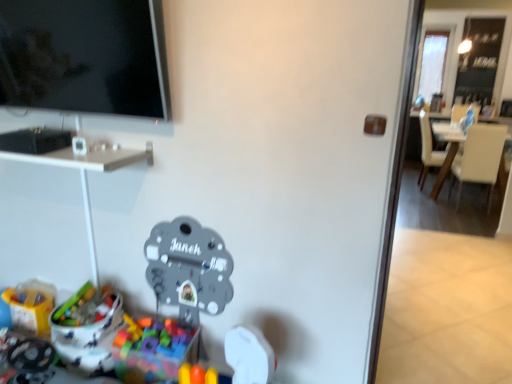
Question: From the image's perspective, is white leather chair at right, positioned as the first chair in back-to-front order, over plastic toy at lower left, the 3th toy when ordered from right to left?

Choices:
 (A) no
 (B) yes

Answer: (B)

Question: Would you say plastic toy at lower left, the 3th toy when ordered from right to left, is part of white leather chair at right, arranged as the 2th chair when viewed from the front,'s contents?

Choices:
 (A) no
 (B) yes

Answer: (A)

Question: Does white leather chair at right, positioned as the first chair in back-to-front order, appear on the left side of plastic toy at lower left, the first toy positioned from the left?

Choices:
 (A) yes
 (B) no

Answer: (B)

Question: Can you confirm if white leather chair at right, positioned as the first chair in back-to-front order, is positioned to the right of plastic toy at lower left, the first toy positioned from the left?

Choices:
 (A) no
 (B) yes

Answer: (B)

Question: From the image's perspective, is white leather chair at right, positioned as the first chair in back-to-front order, below plastic toy at lower left, the first toy positioned from the left?

Choices:
 (A) yes
 (B) no

Answer: (B)

Question: Is white leather chair at right, arranged as the 2th chair when viewed from the front, positioned behind plastic toy at lower left, the 3th toy when ordered from right to left?

Choices:
 (A) no
 (B) yes

Answer: (B)

Question: From the image's perspective, is metallic gray clock at center, which appears as the first toy when viewed from the right, below multicolored plastic blocks at lower left, which ranks as the second toy in right-to-left order?

Choices:
 (A) yes
 (B) no

Answer: (B)

Question: Considering the relative sizes of metallic gray clock at center, which appears as the first toy when viewed from the right, and multicolored plastic blocks at lower left, which ranks as the second toy in right-to-left order, in the image provided, is metallic gray clock at center, which appears as the first toy when viewed from the right, thinner than multicolored plastic blocks at lower left, which ranks as the second toy in right-to-left order,?

Choices:
 (A) yes
 (B) no

Answer: (A)

Question: Is metallic gray clock at center, the third toy positioned from the left, to the right of multicolored plastic blocks at lower left, which ranks as the second toy in right-to-left order, from the viewer's perspective?

Choices:
 (A) yes
 (B) no

Answer: (A)

Question: Considering the relative sizes of metallic gray clock at center, the third toy positioned from the left, and multicolored plastic blocks at lower left, which ranks as the second toy in right-to-left order, in the image provided, is metallic gray clock at center, the third toy positioned from the left, taller than multicolored plastic blocks at lower left, which ranks as the second toy in right-to-left order,?

Choices:
 (A) yes
 (B) no

Answer: (A)

Question: Considering the relative sizes of metallic gray clock at center, which appears as the first toy when viewed from the right, and multicolored plastic blocks at lower left, which ranks as the second toy in right-to-left order, in the image provided, is metallic gray clock at center, which appears as the first toy when viewed from the right, shorter than multicolored plastic blocks at lower left, which ranks as the second toy in right-to-left order,?

Choices:
 (A) no
 (B) yes

Answer: (A)

Question: From the image's perspective, is metallic gray clock at center, which appears as the first toy when viewed from the right, on multicolored plastic blocks at lower left, which ranks as the second toy in right-to-left order?

Choices:
 (A) no
 (B) yes

Answer: (B)

Question: Is white leather chair at right, the 2th chair positioned from the back, at the left side of white glossy desk at upper left?

Choices:
 (A) no
 (B) yes

Answer: (A)